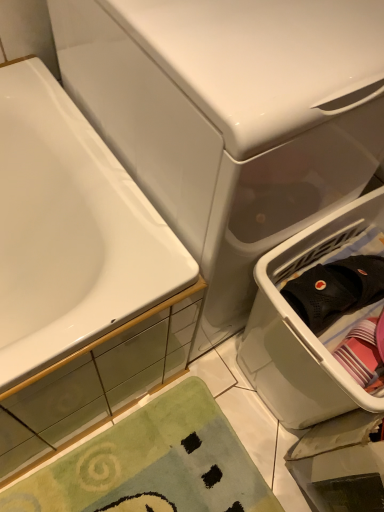
Question: From a real-world perspective, is white glossy bathtub at left over white plastic laundry basket at right?

Choices:
 (A) no
 (B) yes

Answer: (B)

Question: Does white glossy bathtub at left have a lesser width compared to white plastic laundry basket at right?

Choices:
 (A) yes
 (B) no

Answer: (B)

Question: Does white glossy bathtub at left turn towards white plastic laundry basket at right?

Choices:
 (A) no
 (B) yes

Answer: (A)

Question: From the image's perspective, is white glossy bathtub at left above white plastic laundry basket at right?

Choices:
 (A) no
 (B) yes

Answer: (B)

Question: Would you say white glossy bathtub at left contains white plastic laundry basket at right?

Choices:
 (A) yes
 (B) no

Answer: (B)

Question: Based on their positions, is green plush bath mat at lower left located to the left or right of black mesh clothing at right?

Choices:
 (A) right
 (B) left

Answer: (B)

Question: Is green plush bath mat at lower left in front of or behind black mesh clothing at right in the image?

Choices:
 (A) behind
 (B) front

Answer: (A)

Question: Is point (115, 505) positioned closer to the camera than point (352, 267)?

Choices:
 (A) farther
 (B) closer

Answer: (A)

Question: Considering the positions of green plush bath mat at lower left and black mesh clothing at right in the image, is green plush bath mat at lower left taller or shorter than black mesh clothing at right?

Choices:
 (A) tall
 (B) short

Answer: (B)

Question: Is point (228, 245) positioned closer to the camera than point (271, 285)?

Choices:
 (A) farther
 (B) closer

Answer: (B)

Question: In the image, is white glossy water tank at upper center positioned in front of or behind white plastic laundry basket at right?

Choices:
 (A) front
 (B) behind

Answer: (A)

Question: Is white glossy water tank at upper center taller or shorter than white plastic laundry basket at right?

Choices:
 (A) short
 (B) tall

Answer: (B)

Question: From the image's perspective, is white glossy water tank at upper center above or below white plastic laundry basket at right?

Choices:
 (A) above
 (B) below

Answer: (A)

Question: From a real-world perspective, is white glossy bathtub at left above or below white glossy water tank at upper center?

Choices:
 (A) above
 (B) below

Answer: (B)

Question: From the image's perspective, relative to white glossy water tank at upper center, is white glossy bathtub at left above or below?

Choices:
 (A) below
 (B) above

Answer: (A)